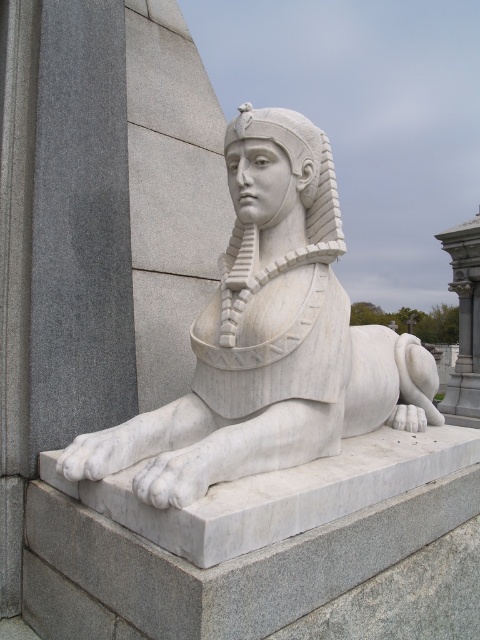
You are an archaeologist examining the layout of an ancient Egyptian temple. You notice the white marble sphinx at center. Based on its position, what are the coordinates of its location in the image?

The white marble sphinx at center is located at coordinates point (269, 339).

You are an architect designing a garden layout and need to place the white marble sphinx at center and the white marble pillar at right. Given their heights, which one should be placed closer to the entrance to ensure visitors notice the taller structure first?

The white marble pillar at right is taller than the white marble sphinx at center. To ensure visitors notice the taller structure first, the white marble pillar at right should be placed closer to the entrance.

You are an archaeologist examining the outdoor area where the white marble sphinx at center and the white marble pillar at right are located. You need to determine the relative positions of these two objects. Based on the scene, which object is positioned to the right side of the other?

The white marble pillar at right is positioned to the right of the white marble sphinx at center.